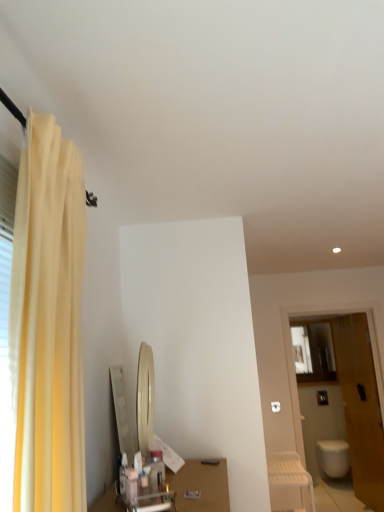
Looking at this image, measure the distance between point (313, 346) and camera.

Point (313, 346) and camera are 5.68 meters apart.

This screenshot has width=384, height=512. What do you see at coordinates (289, 473) in the screenshot?
I see `white plastic chair at lower right` at bounding box center [289, 473].

Measure the distance between point (282,466) and camera.

The distance of point (282,466) from camera is 3.26 meters.

Identify the location of matte glass medicine cabinet at right. (313, 352).

From a real-world perspective, which object rests below the other?

In real-world perspective, matte glass medicine cabinet at right is lower.

Is matte glass medicine cabinet at right turned away from yellow fabric curtain at left?

No, matte glass medicine cabinet at right is not facing away from yellow fabric curtain at left.

Is the surface of matte glass medicine cabinet at right in direct contact with yellow fabric curtain at left?

They are not placed beside each other.

From the image's perspective, which is above, wooden door at right or matte glass medicine cabinet at right?

matte glass medicine cabinet at right is shown above in the image.

Based on their sizes in the image, would you say wooden door at right is bigger or smaller than matte glass medicine cabinet at right?

In the image, wooden door at right appears to be larger than matte glass medicine cabinet at right.

Does wooden door at right come behind matte glass medicine cabinet at right?

No, it is not.

Could you tell me if wooden door at right is facing matte glass medicine cabinet at right?

No.

Who is bigger, white glossy toilet at lower right or matte glass medicine cabinet at right?

With larger size is white glossy toilet at lower right.

What's the angular difference between white glossy toilet at lower right and matte glass medicine cabinet at right's facing directions?

The angular difference between white glossy toilet at lower right and matte glass medicine cabinet at right is 0.0034 degrees.

From a real-world perspective, who is located lower, white glossy toilet at lower right or matte glass medicine cabinet at right?

white glossy toilet at lower right, from a real-world perspective.

Considering the relative sizes of white plastic chair at lower right and matte glass medicine cabinet at right in the image provided, is white plastic chair at lower right wider than matte glass medicine cabinet at right?

Correct, the width of white plastic chair at lower right exceeds that of matte glass medicine cabinet at right.

Does white plastic chair at lower right lie in front of matte glass medicine cabinet at right?

Yes, it is.

In the scene shown: Which is more to the left, white plastic chair at lower right or matte glass medicine cabinet at right?

white plastic chair at lower right is more to the left.

Based on their sizes in the image, would you say matte glass medicine cabinet at right is bigger or smaller than wooden door at right?

matte glass medicine cabinet at right is smaller than wooden door at right.

Which is farther, (295,346) or (370,485)?

Positioned behind is point (370,485).

In the scene shown: From the image's perspective, who appears lower, matte glass medicine cabinet at right or wooden door at right?

wooden door at right.

Considering the relative positions of matte glass medicine cabinet at right and wooden door at right in the image provided, is matte glass medicine cabinet at right behind wooden door at right?

Yes, matte glass medicine cabinet at right is further from the camera.

Considering the sizes of yellow fabric curtain at left and matte glass medicine cabinet at right in the image, is yellow fabric curtain at left bigger or smaller than matte glass medicine cabinet at right?

In the image, yellow fabric curtain at left appears to be larger than matte glass medicine cabinet at right.

Could you tell me if yellow fabric curtain at left is turned towards matte glass medicine cabinet at right?

No.

From the image's perspective, is yellow fabric curtain at left positioned above or below matte glass medicine cabinet at right?

Clearly, from the image's perspective, yellow fabric curtain at left is above matte glass medicine cabinet at right.

From a real-world perspective, is yellow fabric curtain at left physically located above or below matte glass medicine cabinet at right?

yellow fabric curtain at left is above matte glass medicine cabinet at right.

Does white glossy toilet at lower right have a lesser width compared to white plastic chair at lower right?

No.

From a real-world perspective, which is physically above, white glossy toilet at lower right or white plastic chair at lower right?

white plastic chair at lower right.

Does point (338, 450) come closer to viewer compared to point (310, 476)?

Yes, point (338, 450) is in front of point (310, 476).

The width and height of the screenshot is (384, 512). I want to click on curtain in front of the matte glass medicine cabinet at right, so click(48, 323).

There is a wooden door at right. In order to click on medicine cabinet above it (from a real-world perspective) in this screenshot , I will do `click(313, 352)`.

Considering their positions, is yellow fabric curtain at left positioned closer to white glossy toilet at lower right than wooden door at right?

wooden door at right.

Looking at the image, which one is located closer to yellow fabric curtain at left, white glossy toilet at lower right or matte glass medicine cabinet at right?

matte glass medicine cabinet at right.

Based on the photo, estimate the real-world distances between objects in this image. Which object is further from matte glass medicine cabinet at right, yellow fabric curtain at left or white glossy toilet at lower right?

yellow fabric curtain at left.

From the image, which object appears to be nearer to yellow fabric curtain at left, wooden door at right or matte glass medicine cabinet at right?

The object closer to yellow fabric curtain at left is wooden door at right.

Based on the photo, from the image, which object appears to be farther from white plastic chair at lower right, matte glass medicine cabinet at right or white glossy toilet at lower right?

white glossy toilet at lower right lies further to white plastic chair at lower right than the other object.

When comparing their distances from yellow fabric curtain at left, does matte glass medicine cabinet at right or white glossy toilet at lower right seem further?

Among the two, white glossy toilet at lower right is located further to yellow fabric curtain at left.

Which object lies nearer to the anchor point wooden door at right, matte glass medicine cabinet at right or yellow fabric curtain at left?

matte glass medicine cabinet at right is positioned closer to the anchor wooden door at right.

Considering their positions, is yellow fabric curtain at left positioned further to wooden door at right than white glossy toilet at lower right?

The object further to wooden door at right is yellow fabric curtain at left.

You are a GUI agent. You are given a task and a screenshot of the screen. Output one action in this format:
    pyautogui.click(x=<x>, y=<y>)
    Task: Click on the furniture between yellow fabric curtain at left and wooden door at right along the z-axis
    The image size is (384, 512).
    Given the screenshot: What is the action you would take?
    pyautogui.click(x=289, y=473)

Where is `door between yellow fabric curtain at left and white glossy toilet at lower right from front to back`? Image resolution: width=384 pixels, height=512 pixels. door between yellow fabric curtain at left and white glossy toilet at lower right from front to back is located at coordinates (360, 406).

At what (x,y) coordinates should I click in order to perform the action: click on door located between yellow fabric curtain at left and matte glass medicine cabinet at right in the depth direction. Please return your answer as a coordinate pair (x, y). Image resolution: width=384 pixels, height=512 pixels. Looking at the image, I should click on (360, 406).

Locate an element on the screen. toilet between white plastic chair at lower right and matte glass medicine cabinet at right from front to back is located at coordinates (333, 457).